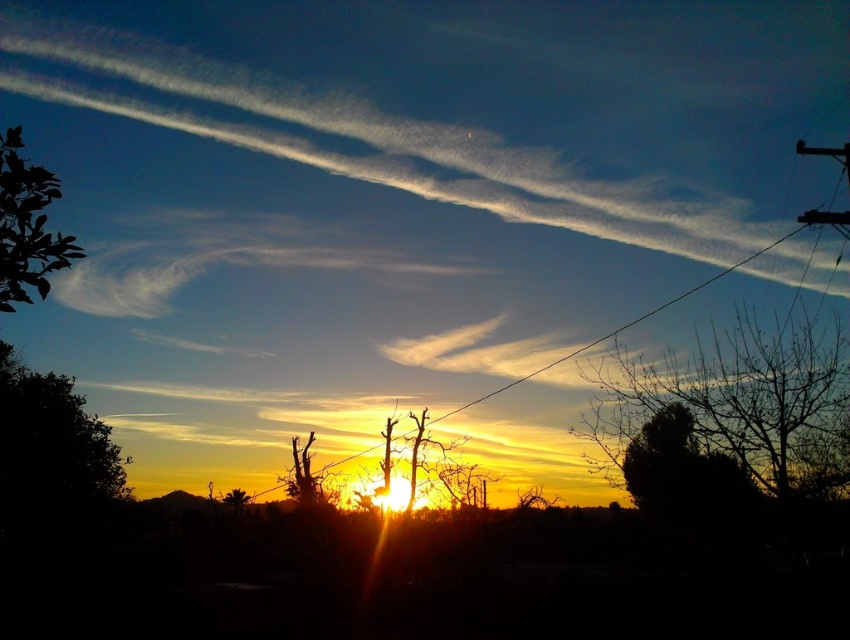
You are an artist trying to sketch this sunset scene. You need to ensure the dark green leafy tree at lower left and the black wire at center are positioned correctly. Based on the scene description, which object should be drawn lower on the paper?

The dark green leafy tree at lower left should be drawn lower on the paper because it is positioned below the black wire at center according to the description.

You are an artist sketching the sunset scene. You have to decide which object to draw first based on their sizes. Which one should you start with, the dark green leafy tree at lower left or the black wire at center?

The black wire at center is wider than the dark green leafy tree at lower left, so you should start drawing the black wire at center first because it is larger in width.